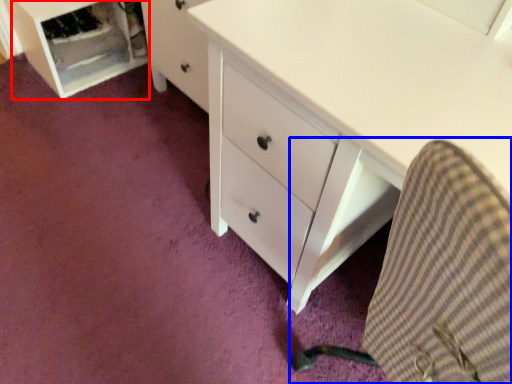
Question: Among these objects, which one is nearest to the camera, file cabinet (highlighted by a red box) or computer chair (highlighted by a blue box)?

Choices:
 (A) file cabinet
 (B) computer chair

Answer: (B)